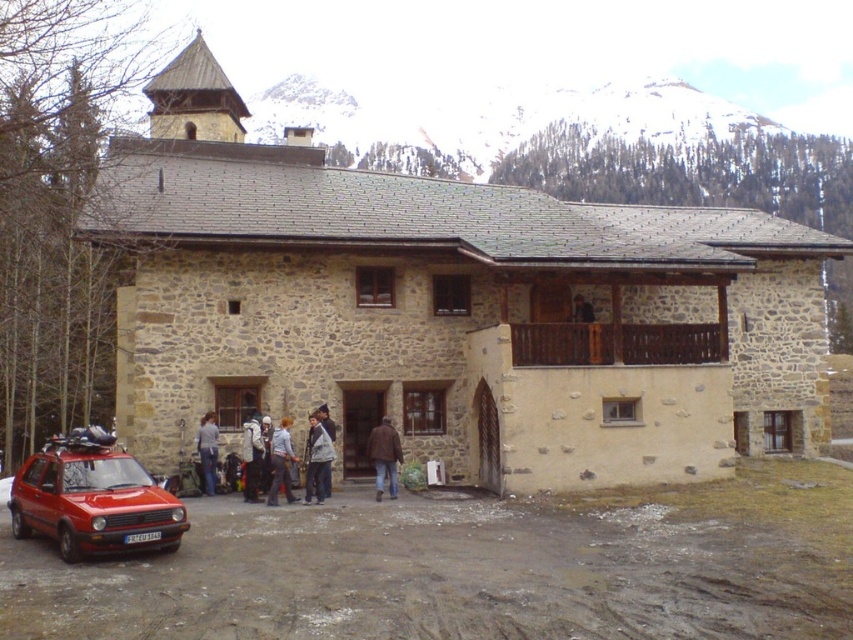
Question: Does stone church at center appear under gray fabric jacket at lower center?

Choices:
 (A) yes
 (B) no

Answer: (B)

Question: Which of the following is the farthest from the observer?

Choices:
 (A) brown leather jacket at center
 (B) white snowboard at center

Answer: (A)

Question: Can you confirm if gray woolen jacket at center is bigger than brown leather jacket at center?

Choices:
 (A) yes
 (B) no

Answer: (A)

Question: Which point is closer to the camera?

Choices:
 (A) (242, 461)
 (B) (808, 272)
 (C) (320, 458)

Answer: (C)

Question: Is shiny red car at lower left in front of brown leather jacket at center?

Choices:
 (A) no
 (B) yes

Answer: (B)

Question: Based on their relative distances, which object is farther from the shiny red car at lower left?

Choices:
 (A) light blue denim jacket at center
 (B) gray woolen jacket at center
 (C) white snowboard at center

Answer: (B)